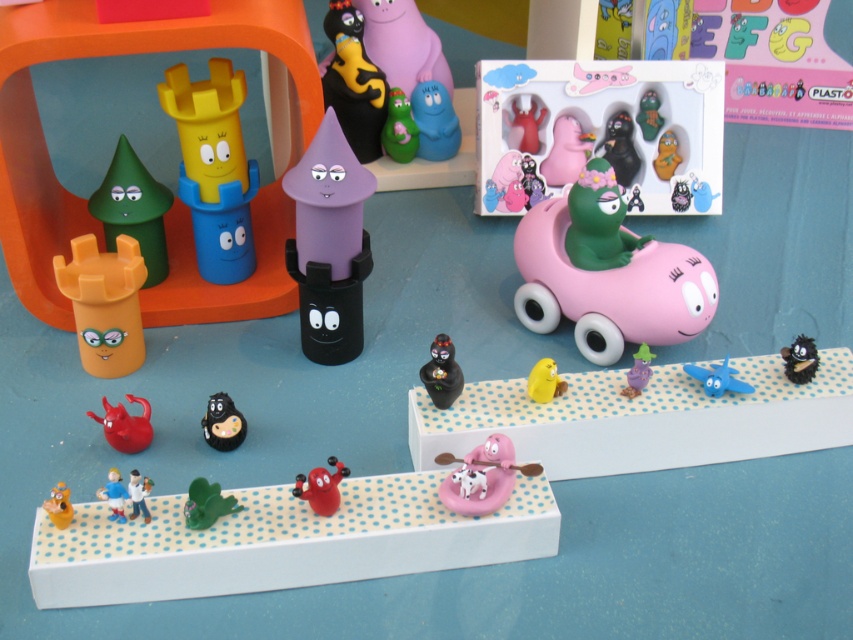
You are a child who wants to stack the black rubber toy at center and the glossy plastic figure at center. Which one should you place at the bottom to make the stack stable?

The black rubber toy at center is much taller than the glossy plastic figure at center, so placing the taller one at the bottom would provide a more stable base for the stack.

You are a child who wants to hand the smooth plastic figure at lower center to your friend standing near the matte black cat at upper center. Can you reach the figure without moving from your current position?

The matte black cat at upper center and smooth plastic figure at lower center are 78.68 centimeters apart from each other. If you are holding the smooth plastic figure at lower center and your friend is near the matte black cat at upper center, the distance between you is about 78.68 centimeters. Whether you can reach depends on your arm length, but typically, most people cannot stretch their arms that far. So it might be difficult to reach without moving.

You are a child trying to reach the smooth plastic figure at lower center on the table. There is a matte black cat at upper center in the way. Can you move the cat to get to the plastic figure?

The matte black cat at upper center is further to the viewer than the smooth plastic figure at lower center, so you can move the cat out of the way to reach the plastic figure.